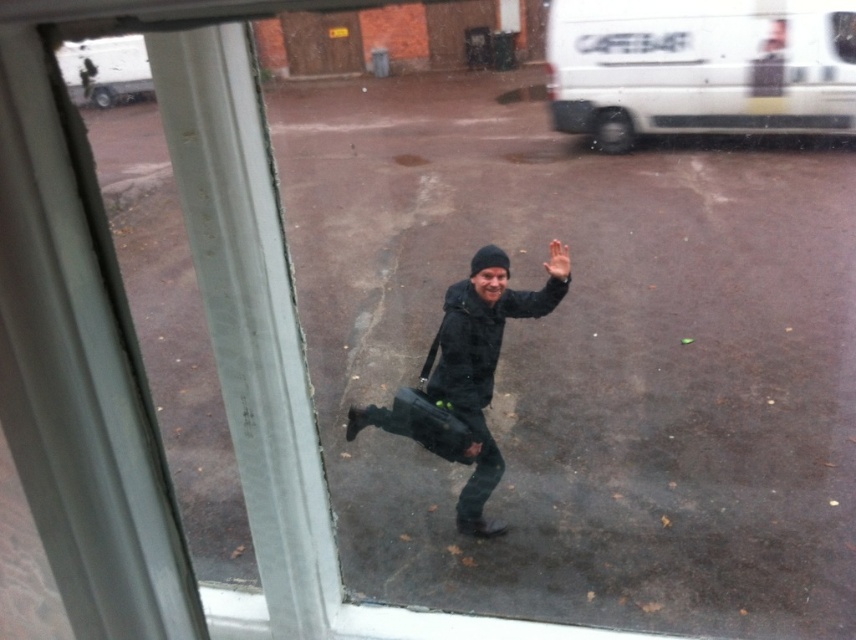
You are standing inside a building looking through the window. You see a white matte van at upper right and a matte skin hand at center. Which object is located to the right of the other?

The white matte van at upper right is positioned on the right side of matte skin hand at center.

You are standing inside a building looking through the window. There is a point marked at coordinates [699,67]. What object is located at that point?

The white matte van at upper right is located at point [699,67].

You are standing inside a building and looking through the window. You see a white matte van at upper right and a brown wooden door at upper center. Which object is nearer to you?

The white matte van at upper right is closer to the viewer than the brown wooden door at upper center.